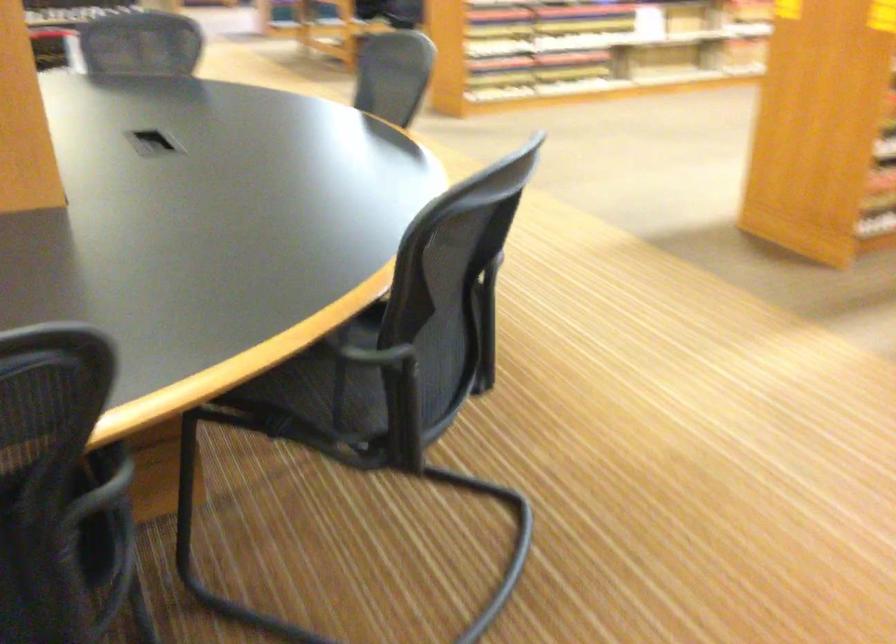
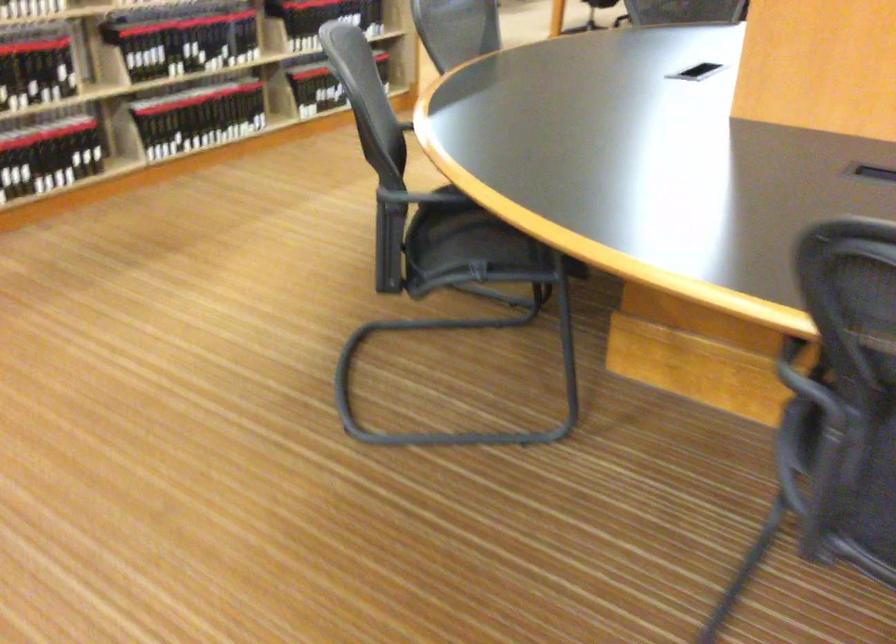
Question: In a continuous first-person perspective shot, in which direction is the camera moving?

Choices:
 (A) Left
 (B) Right
 (C) Forward
 (D) Backward

Answer: (A)